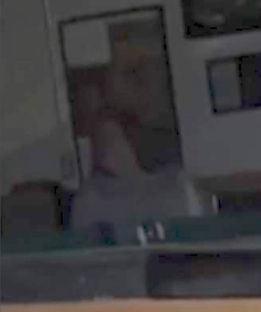
Find the location of a particular element. left corner is located at coordinates (0, 177).